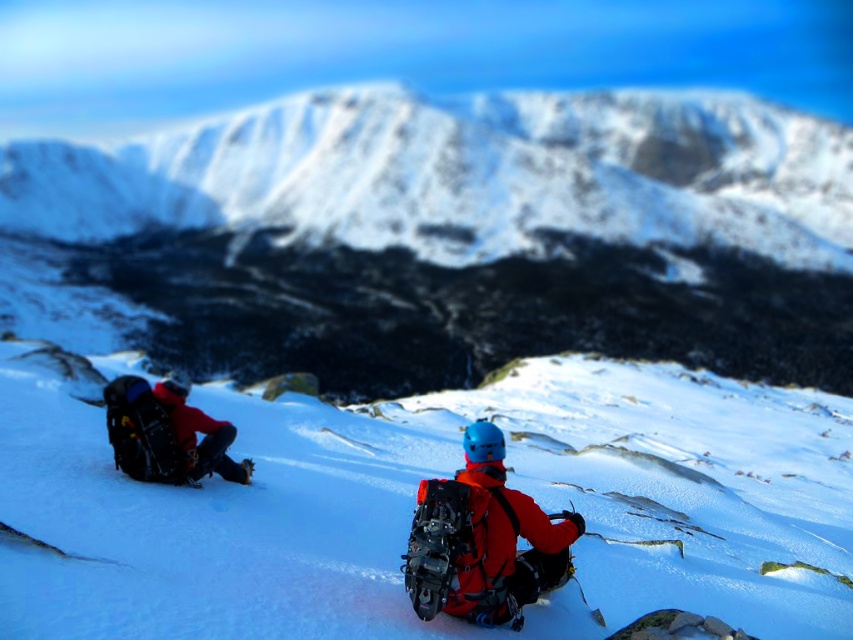
Question: Which point appears closest to the camera in this image?

Choices:
 (A) (173, 545)
 (B) (201, 440)
 (C) (537, 529)

Answer: (C)

Question: Which object is closer to the camera taking this photo?

Choices:
 (A) matte red jacket at left
 (B) matte orange jacket at center
 (C) snowy mountain at upper center
 (D) white powdery snow at center

Answer: (D)

Question: Does white powdery snow at center appear over matte orange jacket at center?

Choices:
 (A) yes
 (B) no

Answer: (A)

Question: Does white powdery snow at center appear on the left side of matte red jacket at left?

Choices:
 (A) yes
 (B) no

Answer: (B)

Question: Which point is closer to the camera?

Choices:
 (A) (177, 257)
 (B) (514, 541)

Answer: (B)

Question: Is matte orange jacket at center wider than matte red jacket at left?

Choices:
 (A) yes
 (B) no

Answer: (B)